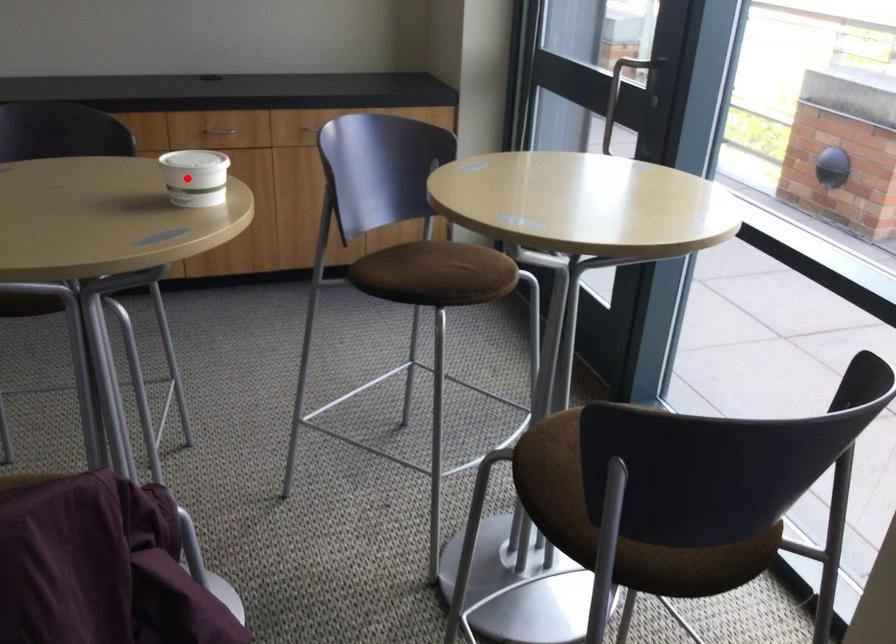
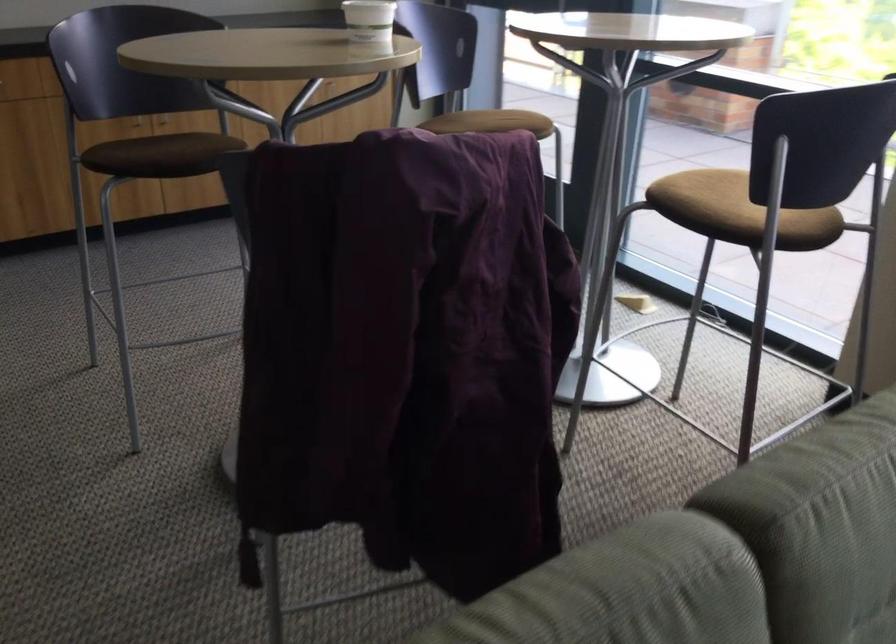
Question: I am providing you with two images of the same scene from different viewpoints. Given a red point in image1, look at the same physical point in image2. Is it:

Choices:
 (A) Closer to the viewpoint
 (B) Farther from the viewpoint

Answer: (B)